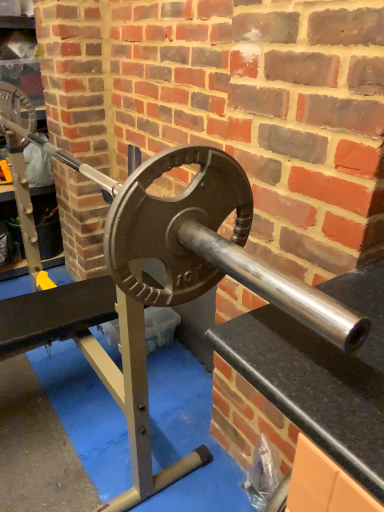
Question: Should I look upward or downward to see shiny metallic barbell at center?

Choices:
 (A) down
 (B) up

Answer: (B)